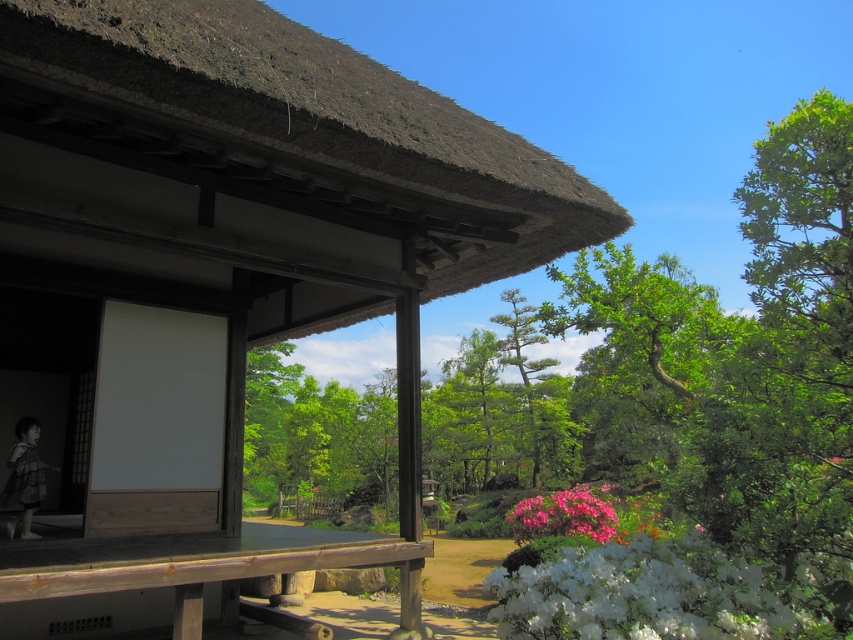
Question: Observing the image, what is the correct spatial positioning of wooden picnic table at center in reference to green leafy tree at center?

Choices:
 (A) right
 (B) left

Answer: (B)

Question: Among these points, which one is farthest from the camera?

Choices:
 (A) (613, 529)
 (B) (22, 406)
 (C) (532, 310)

Answer: (C)

Question: Considering the relative positions of thatched roof hut at center and pink matte flower at lower right in the image provided, where is thatched roof hut at center located with respect to pink matte flower at lower right?

Choices:
 (A) above
 (B) below

Answer: (A)

Question: Which object is positioned closest to the pink matte flower at lower right?

Choices:
 (A) wooden picnic table at center
 (B) thatched roof hut at center
 (C) green leafy tree at center

Answer: (A)

Question: Which point is closer to the camera?

Choices:
 (A) [576, 490]
 (B) [187, 582]
 (C) [519, 355]

Answer: (B)

Question: Is thatched roof hut at center in front of green leafy tree at center?

Choices:
 (A) yes
 (B) no

Answer: (A)